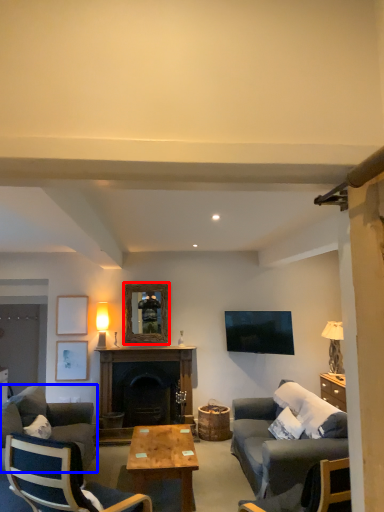
Question: Which point is further to the camera, picture frame (highlighted by a red box) or studio couch (highlighted by a blue box)?

Choices:
 (A) picture frame
 (B) studio couch

Answer: (A)